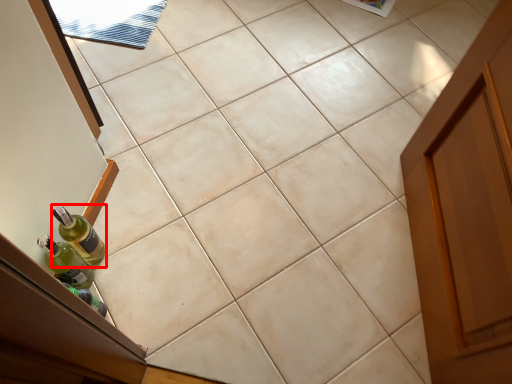
Question: Considering the relative positions of bottle (annotated by the red box) and bottle in the image provided, where is bottle (annotated by the red box) located with respect to the staircase?

Choices:
 (A) right
 (B) left

Answer: (A)